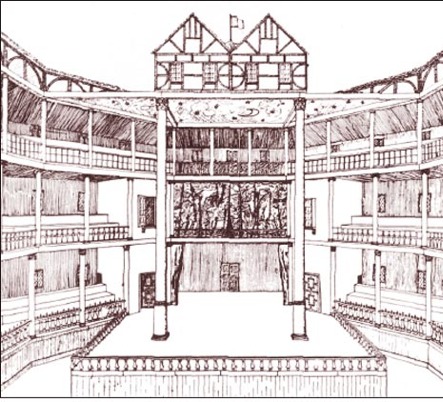
Image resolution: width=443 pixels, height=402 pixels. I want to click on stage, so click(x=200, y=334).